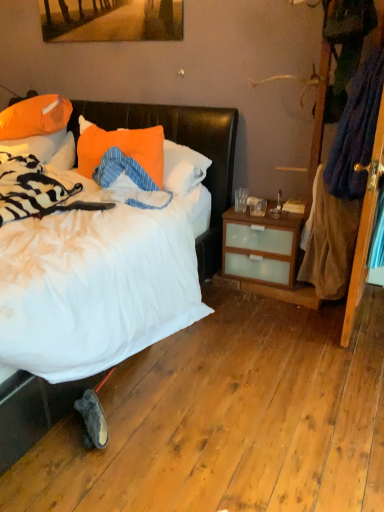
Find the location of a particular element. This screenshot has height=512, width=384. white soft bed at left is located at coordinates (188, 146).

The width and height of the screenshot is (384, 512). What do you see at coordinates (111, 20) in the screenshot? I see `matte wooden picture frame at upper center` at bounding box center [111, 20].

Locate an element on the screen. The width and height of the screenshot is (384, 512). orange fabric pillow at upper left, which is the 2th pillow from right to left is located at coordinates (35, 117).

What do you see at coordinates (35, 117) in the screenshot? The height and width of the screenshot is (512, 384). I see `orange fabric pillow at upper left, which is counted as the second pillow, starting from the left` at bounding box center [35, 117].

Describe the element at coordinates (364, 229) in the screenshot. I see `wooden screen door at right` at that location.

This screenshot has height=512, width=384. Describe the element at coordinates (121, 148) in the screenshot. I see `orange fabric pillow at center, the 1th pillow from the right` at that location.

Identify the location of white soft bed at left. click(188, 146).

Considering the relative sizes of orange fabric pillow at upper left, the first pillow positioned from the left, and orange fabric pillow at center, the 1th pillow from the right, in the image provided, is orange fabric pillow at upper left, the first pillow positioned from the left, thinner than orange fabric pillow at center, the 1th pillow from the right,?

No.

From a real-world perspective, is orange fabric pillow at upper left, the first pillow positioned from the left, physically below orange fabric pillow at center, marked as the third pillow in a left-to-right arrangement?

Yes.

Between orange fabric pillow at upper left, the 3th pillow in the right-to-left sequence, and orange fabric pillow at center, the 1th pillow from the right, which one has smaller size?

Smaller between the two is orange fabric pillow at center, the 1th pillow from the right.

Looking at this image, what's the angular difference between orange fabric pillow at upper left, the 3th pillow in the right-to-left sequence, and orange fabric pillow at center, marked as the third pillow in a left-to-right arrangement,'s facing directions?

0.000318 degrees separate the facing orientations of orange fabric pillow at upper left, the 3th pillow in the right-to-left sequence, and orange fabric pillow at center, marked as the third pillow in a left-to-right arrangement.

From a real-world perspective, is white soft bed at left over orange fabric pillow at center, marked as the third pillow in a left-to-right arrangement?

Incorrect, from a real-world perspective, white soft bed at left is lower than orange fabric pillow at center, marked as the third pillow in a left-to-right arrangement.

Can we say white soft bed at left lies outside orange fabric pillow at center, the 1th pillow from the right?

Absolutely, white soft bed at left is external to orange fabric pillow at center, the 1th pillow from the right.

Are white soft bed at left and orange fabric pillow at center, the 1th pillow from the right, located far from each other?

Actually, white soft bed at left and orange fabric pillow at center, the 1th pillow from the right, are a little close together.

Between white soft bed at left and orange fabric pillow at center, marked as the third pillow in a left-to-right arrangement, which one has larger width?

white soft bed at left.

Is orange fabric pillow at center, the 1th pillow from the right, oriented towards wooden screen door at right?

No, orange fabric pillow at center, the 1th pillow from the right, is not turned towards wooden screen door at right.

Is orange fabric pillow at center, marked as the third pillow in a left-to-right arrangement, in front of wooden screen door at right?

No, it is not.

Is orange fabric pillow at upper left, which is counted as the second pillow, starting from the left, to the left or to the right of dark gray suede sneaker at lower left in the image?

orange fabric pillow at upper left, which is counted as the second pillow, starting from the left, is to the left of dark gray suede sneaker at lower left.

Is orange fabric pillow at upper left, which is counted as the second pillow, starting from the left, bigger than dark gray suede sneaker at lower left?

Yes, orange fabric pillow at upper left, which is counted as the second pillow, starting from the left, is bigger than dark gray suede sneaker at lower left.

Consider the image. Is orange fabric pillow at upper left, which is counted as the second pillow, starting from the left, inside the boundaries of dark gray suede sneaker at lower left, or outside?

orange fabric pillow at upper left, which is counted as the second pillow, starting from the left, is outside dark gray suede sneaker at lower left.

Does orange fabric pillow at upper left, which is the 2th pillow from right to left, come in front of dark gray suede sneaker at lower left?

No, orange fabric pillow at upper left, which is the 2th pillow from right to left, is behind dark gray suede sneaker at lower left.

Can you confirm if dark gray suede sneaker at lower left is thinner than matte wooden picture frame at upper center?

No, dark gray suede sneaker at lower left is not thinner than matte wooden picture frame at upper center.

Considering the sizes of objects dark gray suede sneaker at lower left and matte wooden picture frame at upper center in the image provided, who is shorter, dark gray suede sneaker at lower left or matte wooden picture frame at upper center?

With less height is dark gray suede sneaker at lower left.

You are a GUI agent. You are given a task and a screenshot of the screen. Output one action in this format:
    pyautogui.click(x=<x>, y=<y>)
    Task: Click on the picture frame above the dark gray suede sneaker at lower left (from a real-world perspective)
    
    Given the screenshot: What is the action you would take?
    pyautogui.click(x=111, y=20)

What's the angular difference between dark gray suede sneaker at lower left and matte wooden picture frame at upper center's facing directions?

dark gray suede sneaker at lower left and matte wooden picture frame at upper center are facing 40.1 degrees away from each other.

From a real-world perspective, which is physically above, orange fabric pillow at upper left, which is counted as the second pillow, starting from the left, or white soft bed at left?

orange fabric pillow at upper left, which is counted as the second pillow, starting from the left, from a real-world perspective.

Can you tell me how much orange fabric pillow at upper left, which is counted as the second pillow, starting from the left, and white soft bed at left differ in facing direction?

They differ by 1.72 degrees in their facing directions.

Is orange fabric pillow at upper left, which is the 2th pillow from right to left, inside or outside of white soft bed at left?

orange fabric pillow at upper left, which is the 2th pillow from right to left, can be found inside white soft bed at left.

Is orange fabric pillow at upper left, which is counted as the second pillow, starting from the left, with white soft bed at left?

No, orange fabric pillow at upper left, which is counted as the second pillow, starting from the left, is not making contact with white soft bed at left.

Is wooden screen door at right placed right next to dark gray suede sneaker at lower left?

No, wooden screen door at right is not making contact with dark gray suede sneaker at lower left.

Looking at their sizes, would you say wooden screen door at right is wider or thinner than dark gray suede sneaker at lower left?

wooden screen door at right is wider than dark gray suede sneaker at lower left.

Measure the distance between wooden screen door at right and dark gray suede sneaker at lower left.

They are 1.32 meters apart.

The image size is (384, 512). Identify the location of sneakers on the left side of wooden screen door at right. (92, 420).

From the image's perspective, starting from the orange fabric pillow at center, marked as the third pillow in a left-to-right arrangement, which pillow is the 1st one above? Please provide its 2D coordinates.

[(45, 148)]

At what (x,y) coordinates should I click in order to perform the action: click on bed that appears in front of the orange fabric pillow at center, the 1th pillow from the right. Please return your answer as a coordinate pair (x, y). The height and width of the screenshot is (512, 384). Looking at the image, I should click on (188, 146).

Which object lies nearer to the anchor point matte wooden picture frame at upper center, dark gray suede sneaker at lower left or orange fabric pillow at upper left, which is counted as the second pillow, starting from the left?

Among the two, orange fabric pillow at upper left, which is counted as the second pillow, starting from the left, is located nearer to matte wooden picture frame at upper center.

When comparing their distances from orange fabric pillow at upper left, which is the 2th pillow from right to left, does white soft bed at left or matte wooden picture frame at upper center seem further?

matte wooden picture frame at upper center lies further to orange fabric pillow at upper left, which is the 2th pillow from right to left, than the other object.

Which object lies nearer to the anchor point wooden screen door at right, orange fabric pillow at upper left, which is counted as the second pillow, starting from the left, or matte wooden picture frame at upper center?

The object closer to wooden screen door at right is matte wooden picture frame at upper center.

When comparing their distances from dark gray suede sneaker at lower left, does orange fabric pillow at upper left, which is counted as the second pillow, starting from the left, or orange fabric pillow at center, the 1th pillow from the right, seem further?

orange fabric pillow at upper left, which is counted as the second pillow, starting from the left.

Based on their spatial positions, is orange fabric pillow at upper left, the 3th pillow in the right-to-left sequence, or matte wooden picture frame at upper center further from dark gray suede sneaker at lower left?

matte wooden picture frame at upper center is positioned further to the anchor dark gray suede sneaker at lower left.

Estimate the real-world distances between objects in this image. Which object is closer to matte wooden picture frame at upper center, dark gray suede sneaker at lower left or orange fabric pillow at center, marked as the third pillow in a left-to-right arrangement?

orange fabric pillow at center, marked as the third pillow in a left-to-right arrangement.

Considering their positions, is white soft bed at left positioned further to orange fabric pillow at upper left, which is the 2th pillow from right to left, than wooden screen door at right?

wooden screen door at right is positioned further to the anchor orange fabric pillow at upper left, which is the 2th pillow from right to left.

Looking at the image, which one is located further to orange fabric pillow at upper left, which is counted as the second pillow, starting from the left, dark gray suede sneaker at lower left or orange fabric pillow at upper left, the 3th pillow in the right-to-left sequence?

Among the two, dark gray suede sneaker at lower left is located further to orange fabric pillow at upper left, which is counted as the second pillow, starting from the left.

Locate an element on the screen. bed that lies between matte wooden picture frame at upper center and dark gray suede sneaker at lower left from top to bottom is located at coordinates (188, 146).

Where is `pillow between matte wooden picture frame at upper center and orange fabric pillow at upper left, the first pillow positioned from the left, in the up-down direction`? pillow between matte wooden picture frame at upper center and orange fabric pillow at upper left, the first pillow positioned from the left, in the up-down direction is located at coordinates (35, 117).

You are a GUI agent. You are given a task and a screenshot of the screen. Output one action in this format:
    pyautogui.click(x=<x>, y=<y>)
    Task: Click on the sneakers between orange fabric pillow at center, the 1th pillow from the right, and wooden screen door at right, in the horizontal direction
    This screenshot has width=384, height=512.
    Given the screenshot: What is the action you would take?
    pyautogui.click(x=92, y=420)

Where is `screen door between matte wooden picture frame at upper center and dark gray suede sneaker at lower left in the up-down direction`? This screenshot has height=512, width=384. screen door between matte wooden picture frame at upper center and dark gray suede sneaker at lower left in the up-down direction is located at coordinates (364, 229).